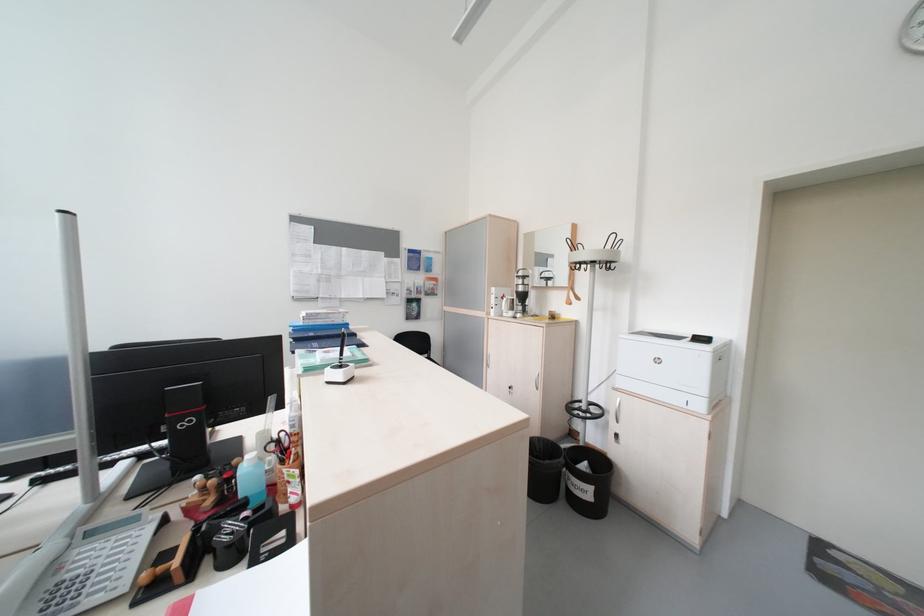
At what (x,y) coordinates should I click in order to perform the action: click on coat stand hook. Please return your answer as a coordinate pair (x, y). Looking at the image, I should click on tap(593, 254).